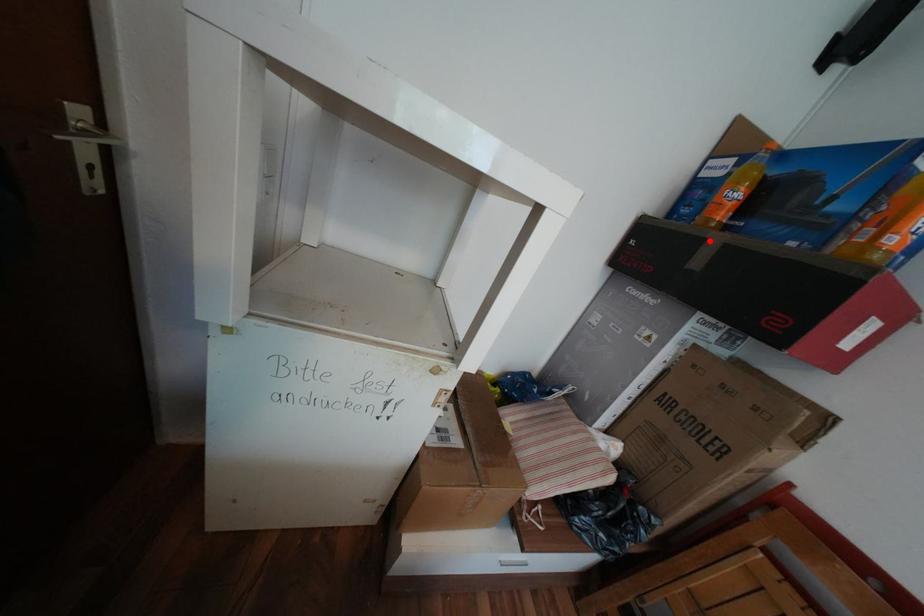
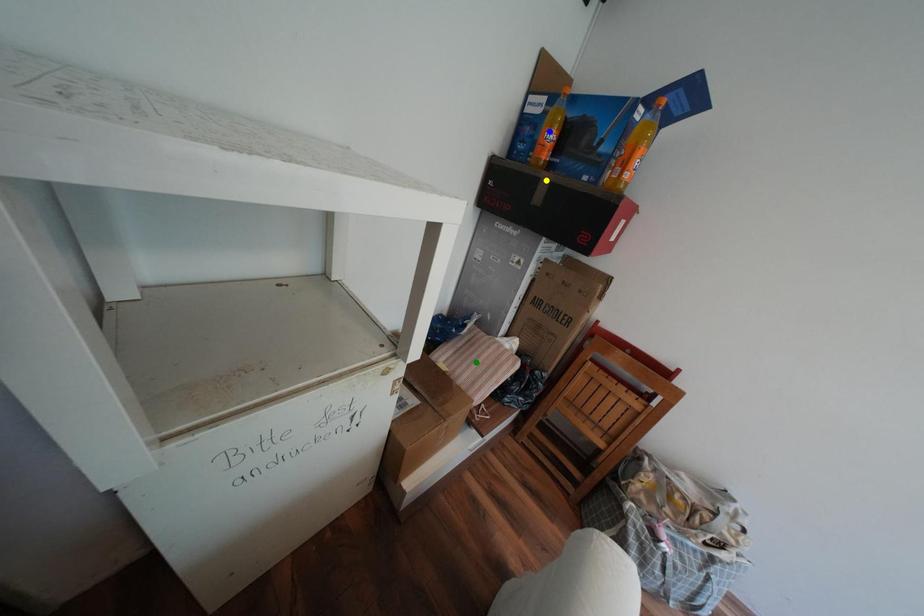
Question: I am providing you with two images of the same scene from different viewpoints. A red point is marked on the first image. You are given multiple points on the second image. Which point in image 2 is actually the same real-world point as the red point in image 1?

Choices:
 (A) green point
 (B) blue point
 (C) yellow point

Answer: (C)